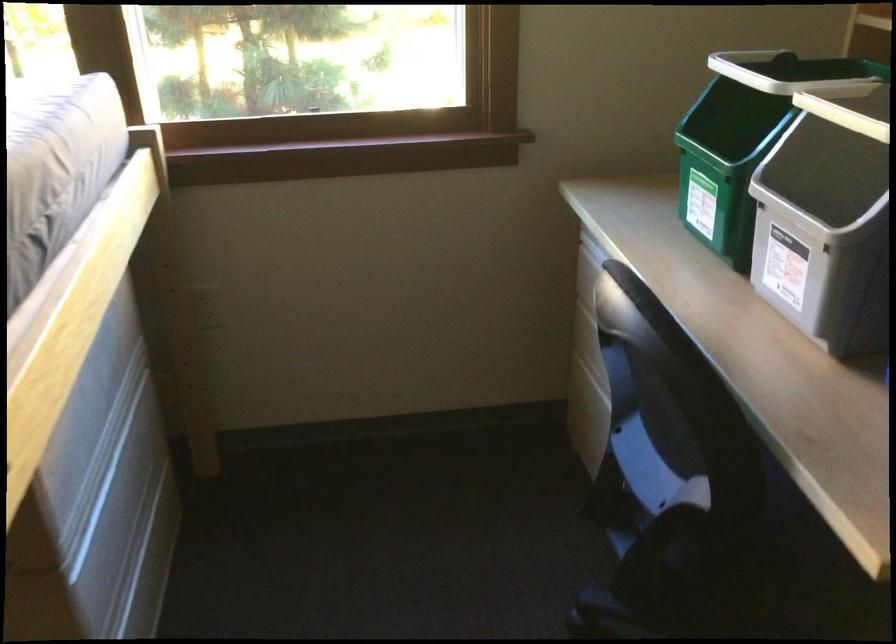
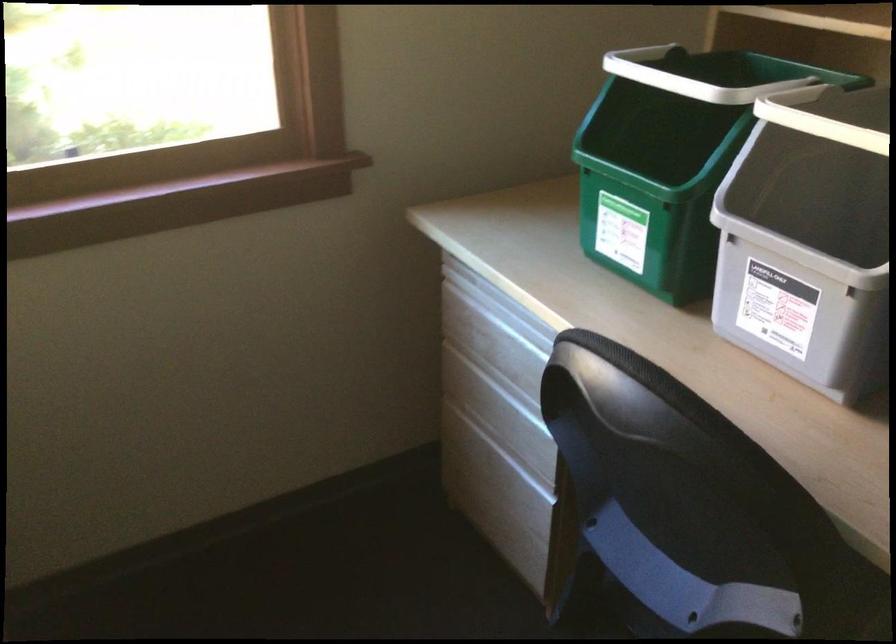
Locate, in the second image, the point that corresponds to point (796, 214) in the first image.

(797, 250)